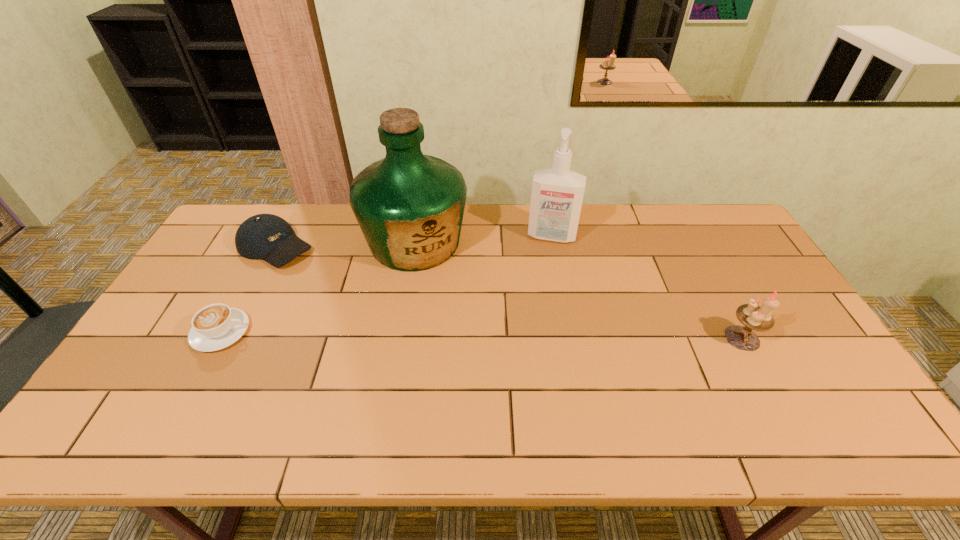
Locate an element on the screen. The height and width of the screenshot is (540, 960). vacant space located on the label side of the third object from right to left is located at coordinates (440, 299).

You are a GUI agent. You are given a task and a screenshot of the screen. Output one action in this format:
    pyautogui.click(x=<x>, y=<y>)
    Task: Click on the vacant region located 0.260m on the label side of the third object from right to left
    This screenshot has width=960, height=540.
    Given the screenshot: What is the action you would take?
    pyautogui.click(x=457, y=339)

At what (x,y) coordinates should I click in order to perform the action: click on free spot located on the front label of the second tallest object. Please return your answer as a coordinate pair (x, y). This screenshot has width=960, height=540. Looking at the image, I should click on (543, 274).

The image size is (960, 540). Identify the location of free region located on the front label of the second tallest object. (540, 285).

Where is `vacant space located on the front label of the second tallest object`? vacant space located on the front label of the second tallest object is located at coordinates (539, 299).

The height and width of the screenshot is (540, 960). Identify the location of free location located on the front-facing side of the baseball cap. pyautogui.click(x=315, y=269).

At what (x,y) coordinates should I click in order to perform the action: click on vacant space situated 0.350m on the front-facing side of the baseball cap. Please return your answer as a coordinate pair (x, y). This screenshot has height=540, width=960. Looking at the image, I should click on (378, 309).

Where is `blank space located 0.210m on the front-facing side of the baseball cap`? The height and width of the screenshot is (540, 960). blank space located 0.210m on the front-facing side of the baseball cap is located at coordinates (346, 288).

This screenshot has height=540, width=960. Find the location of `liquor present at the far edge`. liquor present at the far edge is located at coordinates (409, 206).

Locate an element on the screen. cleansing agent that is at the far edge is located at coordinates (557, 194).